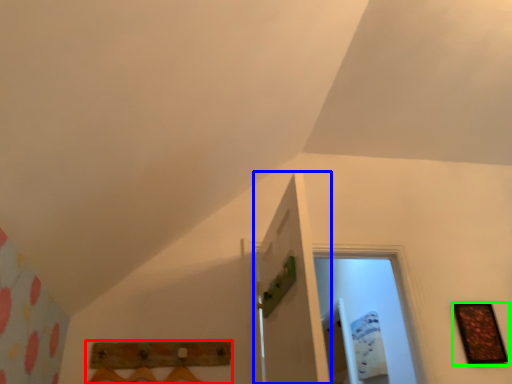
Question: Based on their relative distances, which object is farther from furniture (highlighted by a red box)? Choose from door (highlighted by a blue box) and picture frame (highlighted by a green box).

Choices:
 (A) door
 (B) picture frame

Answer: (B)